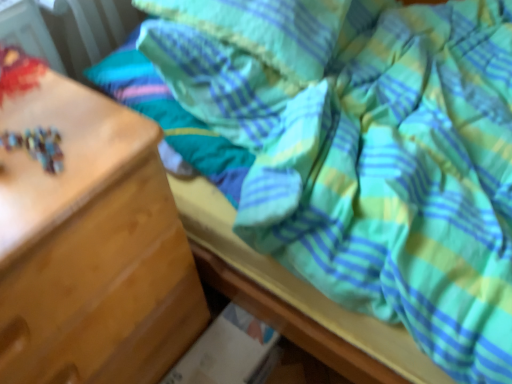
Describe the element at coordinates (266, 29) in the screenshot. I see `soft cotton pillow at upper center` at that location.

I want to click on soft cotton pillow at upper center, so click(266, 29).

The height and width of the screenshot is (384, 512). Describe the element at coordinates (88, 240) in the screenshot. I see `wooden chest of drawers at left` at that location.

Identify the location of wooden chest of drawers at left. (88, 240).

Locate an element on the screen. soft cotton pillow at upper center is located at coordinates (266, 29).

Based on their positions, is wooden chest of drawers at left located to the left or right of soft cotton pillow at upper center?

Clearly, wooden chest of drawers at left is on the left of soft cotton pillow at upper center in the image.

Who is more distant, wooden chest of drawers at left or soft cotton pillow at upper center?

soft cotton pillow at upper center is further from the camera.

Is point (26, 308) more distant than point (258, 29)?

No.

From the image's perspective, between wooden chest of drawers at left and soft cotton pillow at upper center, who is located below?

wooden chest of drawers at left appears lower in the image.

From a real-world perspective, is wooden chest of drawers at left positioned above or below soft cotton pillow at upper center?

wooden chest of drawers at left is below soft cotton pillow at upper center.

Is wooden chest of drawers at left wider or thinner than soft cotton pillow at upper center?

In the image, wooden chest of drawers at left appears to be wider than soft cotton pillow at upper center.

Who is shorter, wooden chest of drawers at left or soft cotton pillow at upper center?

With less height is soft cotton pillow at upper center.

Based on the photo, considering the relative sizes of wooden chest of drawers at left and soft cotton pillow at upper center in the image provided, is wooden chest of drawers at left bigger than soft cotton pillow at upper center?

Yes, wooden chest of drawers at left is bigger than soft cotton pillow at upper center.

Can soft cotton pillow at upper center be found inside wooden chest of drawers at left?

No, soft cotton pillow at upper center is located outside of wooden chest of drawers at left.

Is wooden chest of drawers at left next to soft cotton pillow at upper center and touching it?

They are not placed beside each other.

Is wooden chest of drawers at left oriented towards soft cotton pillow at upper center?

No, wooden chest of drawers at left is not oriented towards soft cotton pillow at upper center.

Measure the distance between wooden chest of drawers at left and soft cotton pillow at upper center.

wooden chest of drawers at left and soft cotton pillow at upper center are 42.84 centimeters apart from each other.

Locate an element on the screen. the chest of drawers in front of the soft cotton pillow at upper center is located at coordinates (88, 240).

Considering the positions of objects soft cotton pillow at upper center and wooden chest of drawers at left in the image provided, who is more to the right, soft cotton pillow at upper center or wooden chest of drawers at left?

soft cotton pillow at upper center.

Does soft cotton pillow at upper center lie behind wooden chest of drawers at left?

Yes, it is behind wooden chest of drawers at left.

Which point is more forward, (313, 64) or (133, 148)?

The point (133, 148) is in front.

From the image's perspective, which is above, soft cotton pillow at upper center or wooden chest of drawers at left?

soft cotton pillow at upper center.

From a real-world perspective, who is located higher, soft cotton pillow at upper center or wooden chest of drawers at left?

soft cotton pillow at upper center.

Is soft cotton pillow at upper center thinner than wooden chest of drawers at left?

Indeed, soft cotton pillow at upper center has a lesser width compared to wooden chest of drawers at left.

Who is taller, soft cotton pillow at upper center or wooden chest of drawers at left?

wooden chest of drawers at left is taller.

Which of these two, soft cotton pillow at upper center or wooden chest of drawers at left, is bigger?

wooden chest of drawers at left.

Would you say soft cotton pillow at upper center contains wooden chest of drawers at left?

No, wooden chest of drawers at left is not inside soft cotton pillow at upper center.

From the picture: Is soft cotton pillow at upper center next to wooden chest of drawers at left and touching it?

soft cotton pillow at upper center and wooden chest of drawers at left are not in contact.

Consider the image. Could you tell me if soft cotton pillow at upper center is turned towards wooden chest of drawers at left?

No, soft cotton pillow at upper center is not facing towards wooden chest of drawers at left.

How different are the orientations of soft cotton pillow at upper center and wooden chest of drawers at left in degrees?

They differ by 21.3 degrees in their facing directions.

The height and width of the screenshot is (384, 512). I want to click on chest of drawers below the soft cotton pillow at upper center (from the image's perspective), so click(88, 240).

The image size is (512, 384). What are the coordinates of `the chest of drawers in front of the soft cotton pillow at upper center` in the screenshot? It's located at (88, 240).

Find the location of a particular element. The height and width of the screenshot is (384, 512). pillow above the wooden chest of drawers at left (from a real-world perspective) is located at coordinates (266, 29).